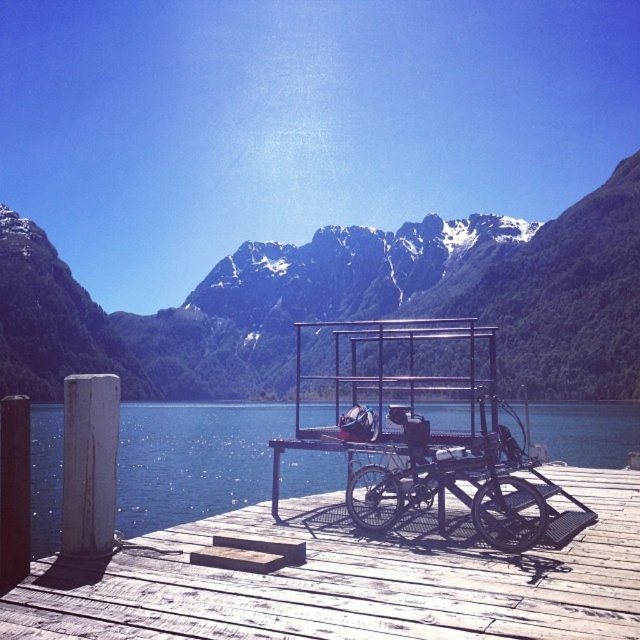
In the scene shown: You are standing on the wooden dock at center and want to move towards the black matte bicycle at center. Which direction should you walk to reach it?

Since the wooden dock at center is to the right of the black matte bicycle at center, you should walk to the left to reach it.

You are standing on the wooden dock and looking towards the lake. Which object, the snowy rock mountain at upper center or the blue water at center, is located to the left of the other?

The snowy rock mountain at upper center is positioned on the left side of blue water at center, so the snowy rock mountain at upper center is to the left of the blue water at center.